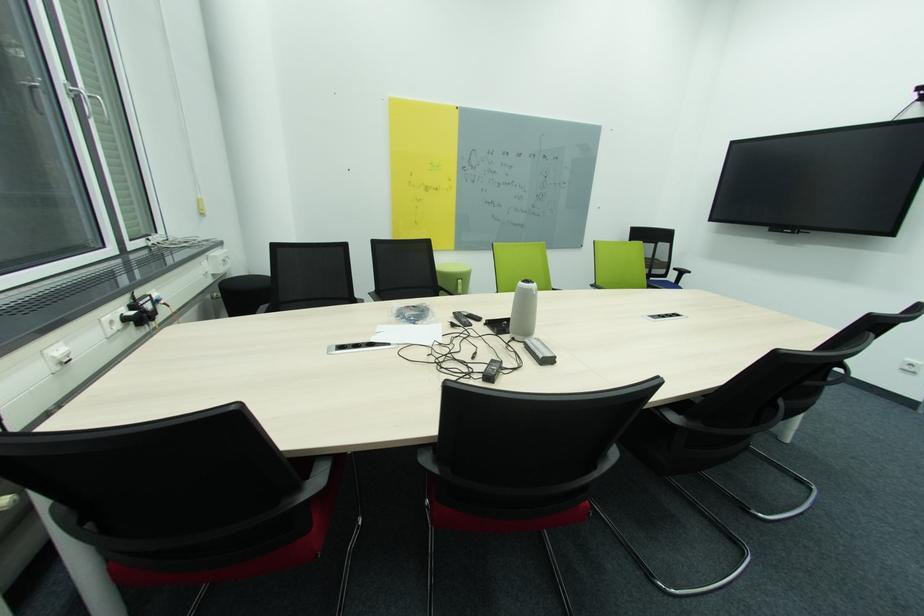
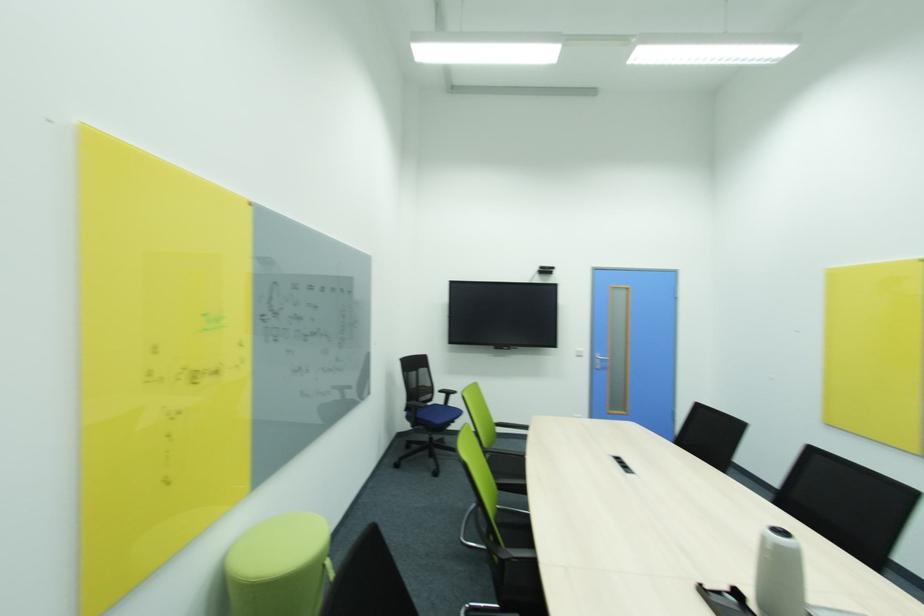
Find the pixel in the second image that matches the point at 667,246 in the first image.

(428, 371)